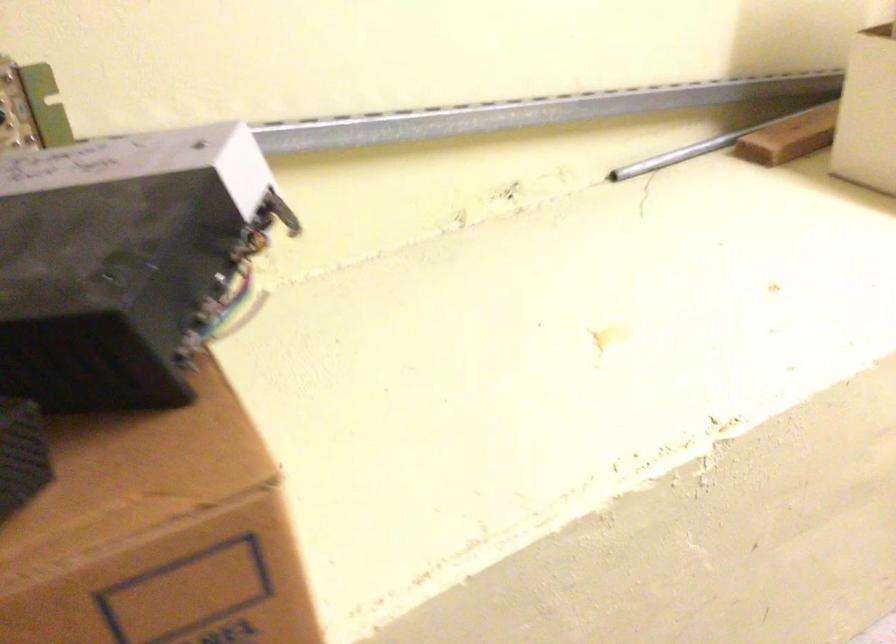
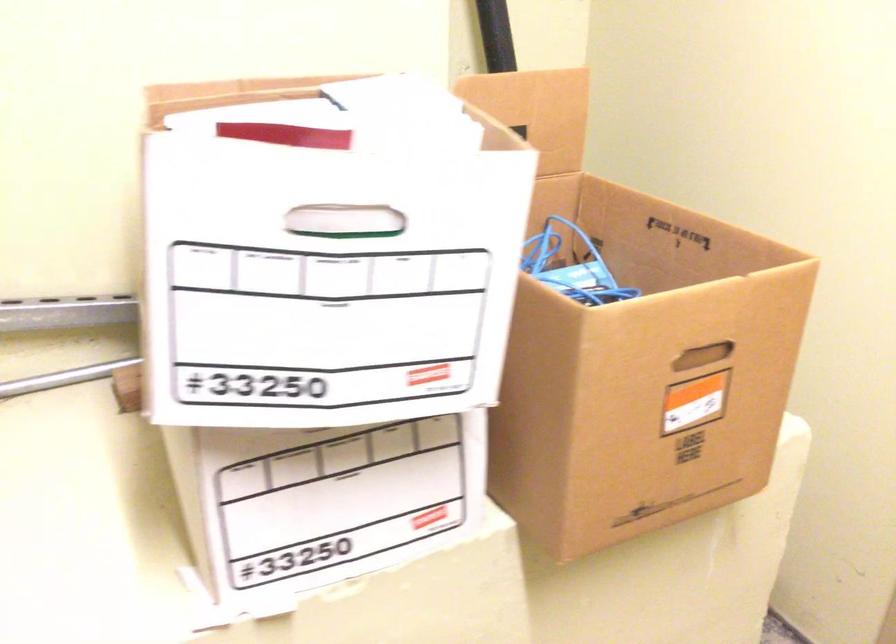
Question: What movement of the cameraman would produce the second image?

Choices:
 (A) Left
 (B) Right
 (C) Forward
 (D) Backward

Answer: (B)